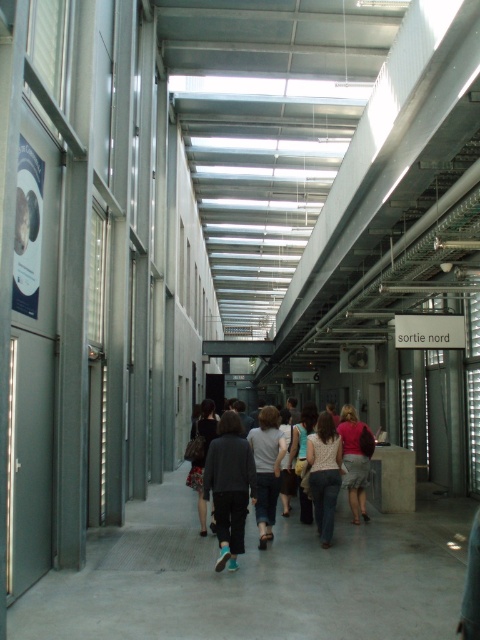
You are standing in the corridor and want to move from the point at coordinates point (322,525) to the point at coordinates point (267,424). Which direction should you move in to get closer to your destination?

Since point (322,525) is further away from the camera than point 0.664, 0558, you should move towards the camera to get closer to your destination.

You are a fashion designer observing a mannequin in the corridor. The mannequin is wearing the patterned fabric blouse at center and the floral skirt at center. Which clothing item is shorter?

The patterned fabric blouse at center is shorter than the floral skirt at center.

You are a fashion designer trying to decide which outfit to display in the center of the corridor. You have a dark gray pants at center and a floral skirt at center. Which one will take up more space in the center area?

The dark gray pants at center is bigger than the floral skirt at center, so it will take up more space in the center area.